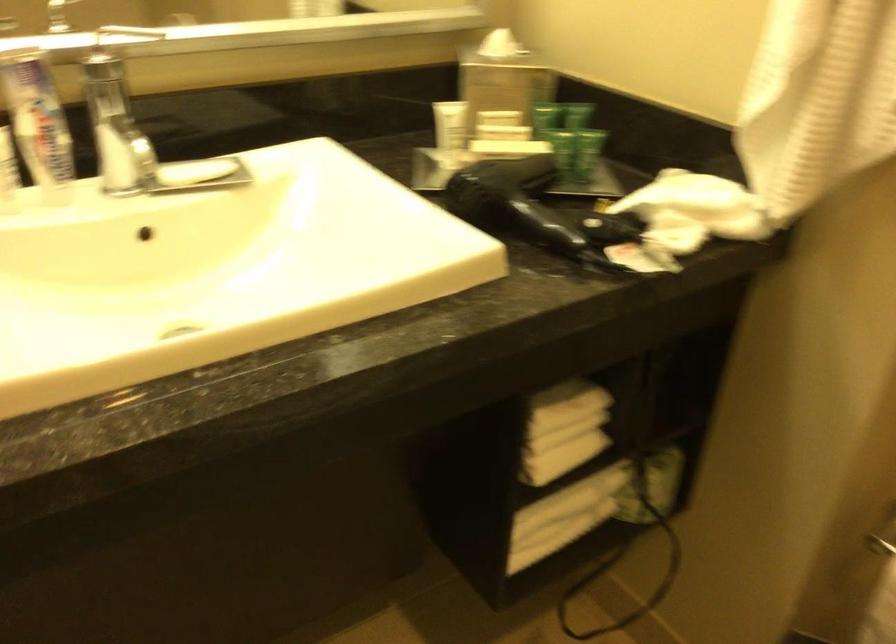
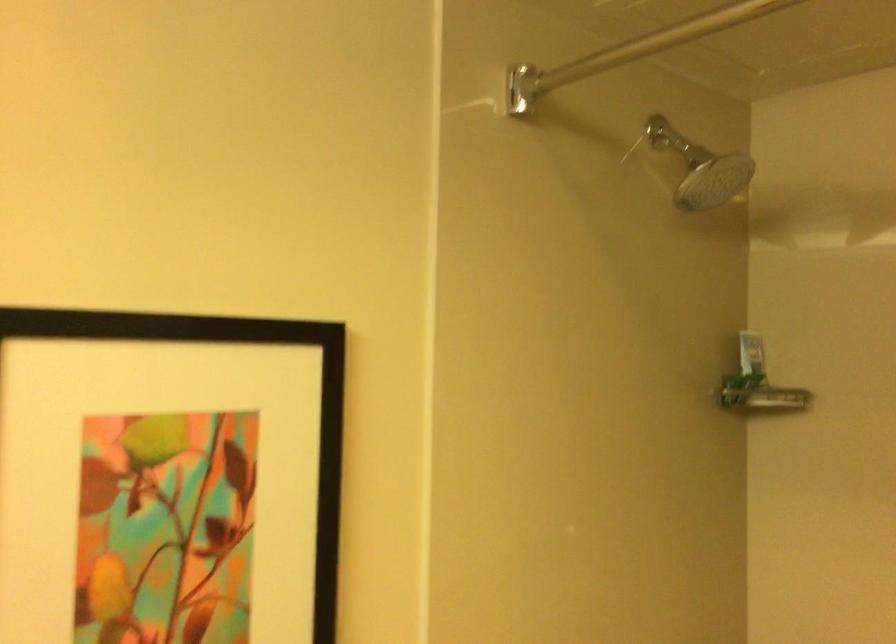
Question: The first image is from the beginning of the video and the second image is from the end. How did the camera likely rotate when shooting the video?

Choices:
 (A) Left
 (B) Right
 (C) Up
 (D) Down

Answer: (B)